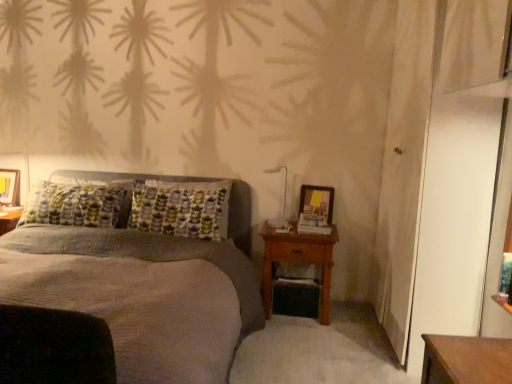
Question: From the image's perspective, would you say matte wooden picture frame at left, acting as the first picture frame starting from the back, is positioned over wooden nightstand at right?

Choices:
 (A) no
 (B) yes

Answer: (B)

Question: Is matte wooden picture frame at left, which ranks as the 2th picture frame in front-to-back order, at the right side of wooden nightstand at right?

Choices:
 (A) no
 (B) yes

Answer: (A)

Question: Does matte wooden picture frame at left, which ranks as the 2th picture frame in front-to-back order, come in front of wooden nightstand at right?

Choices:
 (A) no
 (B) yes

Answer: (A)

Question: From a real-world perspective, does matte wooden picture frame at left, acting as the first picture frame starting from the back, stand above wooden nightstand at right?

Choices:
 (A) yes
 (B) no

Answer: (A)

Question: Is matte wooden picture frame at left, which ranks as the 2th picture frame in front-to-back order, facing away from wooden nightstand at right?

Choices:
 (A) no
 (B) yes

Answer: (A)

Question: Can you confirm if matte wooden picture frame at left, marked as the first picture frame in a left-to-right arrangement, is taller than wooden nightstand at right?

Choices:
 (A) no
 (B) yes

Answer: (A)

Question: Are matte wooden picture frame at right, acting as the first picture frame starting from the right, and wooden nightstand at right beside each other?

Choices:
 (A) yes
 (B) no

Answer: (B)

Question: Does matte wooden picture frame at right, the 2th picture frame viewed from the back, come in front of wooden nightstand at right?

Choices:
 (A) no
 (B) yes

Answer: (A)

Question: Can you confirm if matte wooden picture frame at right, acting as the first picture frame starting from the right, is positioned to the right of wooden nightstand at right?

Choices:
 (A) yes
 (B) no

Answer: (A)

Question: Is matte wooden picture frame at right, which ranks as the 1th picture frame in front-to-back order, at the left side of wooden nightstand at right?

Choices:
 (A) yes
 (B) no

Answer: (B)

Question: Does matte wooden picture frame at right, acting as the first picture frame starting from the right, have a larger size compared to wooden nightstand at right?

Choices:
 (A) no
 (B) yes

Answer: (A)

Question: Is matte wooden picture frame at right, the 2th picture frame viewed from the back, not inside wooden nightstand at right?

Choices:
 (A) yes
 (B) no

Answer: (A)

Question: Would you say white glossy bedside lamp at upper right is a long distance from matte wooden picture frame at left, marked as the first picture frame in a left-to-right arrangement?

Choices:
 (A) yes
 (B) no

Answer: (A)